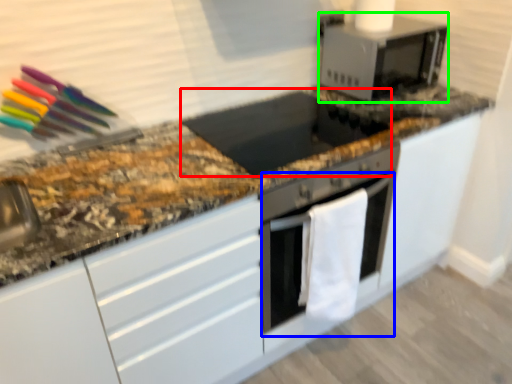
Question: Which is farther away from appliance (highlighted by a red box)? oven (highlighted by a blue box) or microwave oven (highlighted by a green box)?

Choices:
 (A) oven
 (B) microwave oven

Answer: (A)